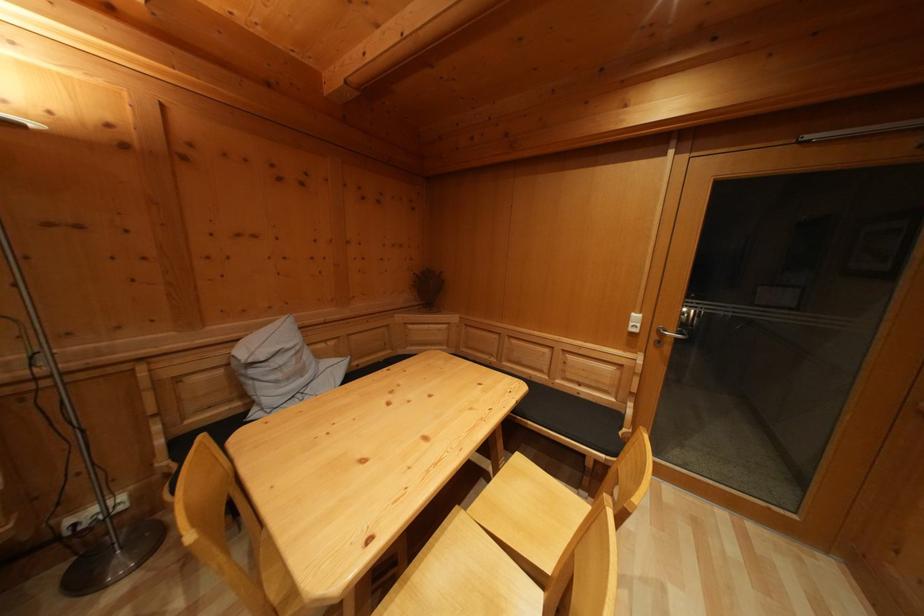
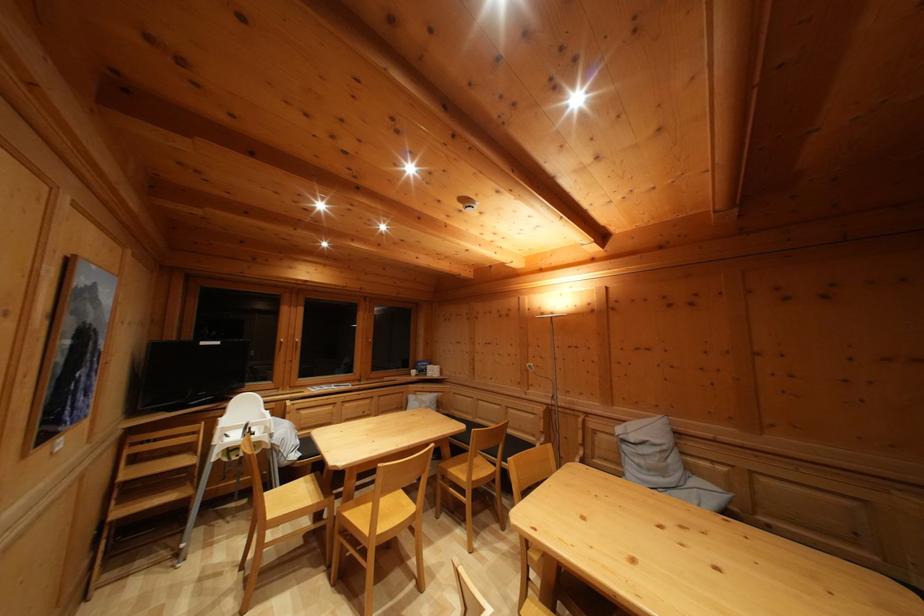
Question: I am providing you with two images of the same scene from different viewpoints. Which of the following objects are not visible in image2?

Choices:
 (A) window handle
 (B) white mug
 (C) chair sitting surface
 (D) none of these

Answer: (D)